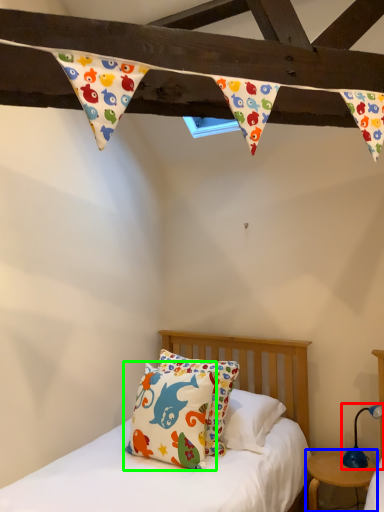
Question: Considering the real-world distances, which object is farthest from table lamp (highlighted by a red box)? nightstand (highlighted by a blue box) or pillow (highlighted by a green box)?

Choices:
 (A) nightstand
 (B) pillow

Answer: (B)